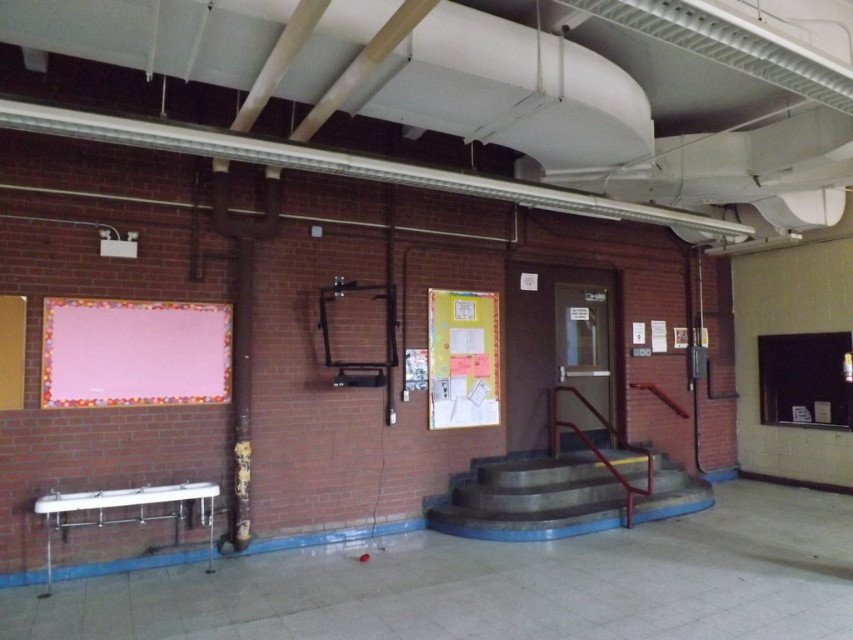
Question: Does pink fabric board at left lie behind yellow paperboard bulletin board at center?

Choices:
 (A) yes
 (B) no

Answer: (B)

Question: Can you confirm if pink fabric board at left is thinner than yellow paperboard bulletin board at center?

Choices:
 (A) no
 (B) yes

Answer: (A)

Question: Among these objects, which one is farthest from the camera?

Choices:
 (A) yellow paperboard bulletin board at center
 (B) pink fabric board at left

Answer: (A)

Question: Among these points, which one is farthest from the camera?

Choices:
 (A) (62, 397)
 (B) (451, 314)

Answer: (B)

Question: Does pink fabric board at left appear on the right side of yellow paperboard bulletin board at center?

Choices:
 (A) yes
 (B) no

Answer: (B)

Question: Among these points, which one is nearest to the camera?

Choices:
 (A) (198, 387)
 (B) (489, 364)

Answer: (A)